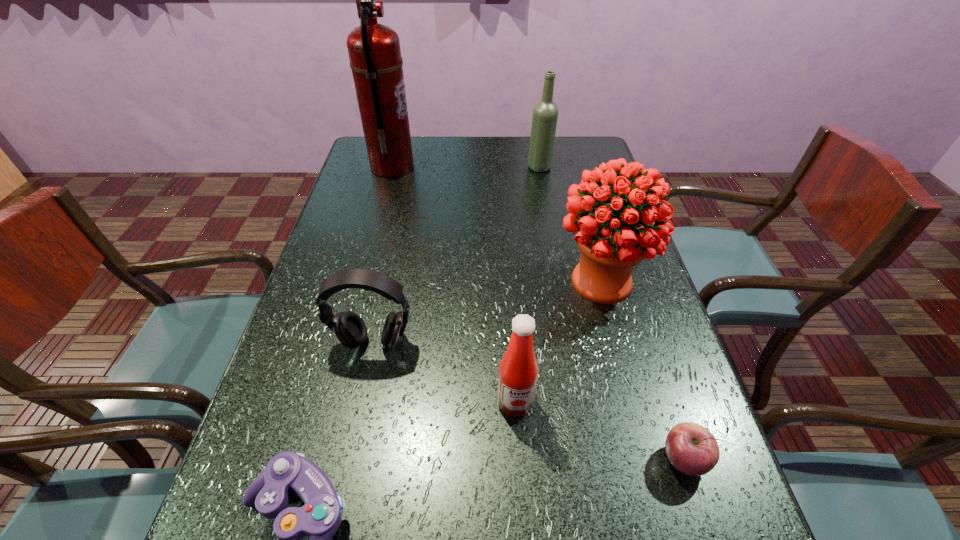
Where is `object that is the sixth nearest to the apple`? This screenshot has height=540, width=960. object that is the sixth nearest to the apple is located at coordinates (374, 51).

Select which object appears as the second closest to the earphone. Please provide its 2D coordinates. Your answer should be formatted as a tuple, i.e. [(x, y)], where the tuple contains the x and y coordinates of a point satisfying the conditions above.

[(319, 519)]

At what (x,y) coordinates should I click in order to perform the action: click on vacant region that satisfies the following two spatial constraints: 1. on the nozzle side of the bouquet; 2. on the left side of the fire extinguisher. Please return your answer as a coordinate pair (x, y). The height and width of the screenshot is (540, 960). Looking at the image, I should click on (362, 281).